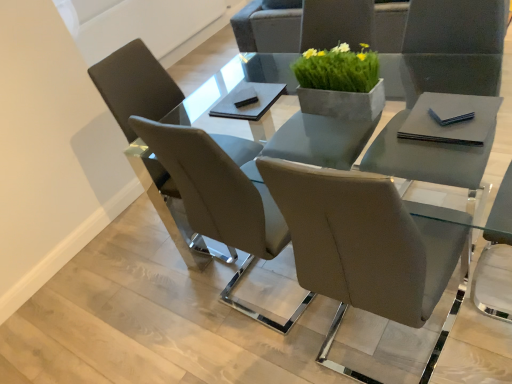
Question: Looking at their shapes, would you say green concrete planter at center is wider or thinner than matte gray chair at center, acting as the first chair starting from the front?

Choices:
 (A) wide
 (B) thin

Answer: (B)

Question: Do you think green concrete planter at center is within matte gray chair at center, the 2th chair positioned from the back, or outside of it?

Choices:
 (A) outside
 (B) inside

Answer: (A)

Question: Which is farther from the clear glass table at center?

Choices:
 (A) green concrete planter at center
 (B) matte gray chair at left, which ranks as the 1th chair in back-to-front order
 (C) matte gray chair at center, acting as the first chair starting from the front

Answer: (C)

Question: Estimate the real-world distances between objects in this image. Which object is farther from the matte gray chair at center, the 2th chair positioned from the back?

Choices:
 (A) green concrete planter at center
 (B) clear glass table at center
 (C) matte gray chair at left, which ranks as the 1th chair in back-to-front order

Answer: (B)